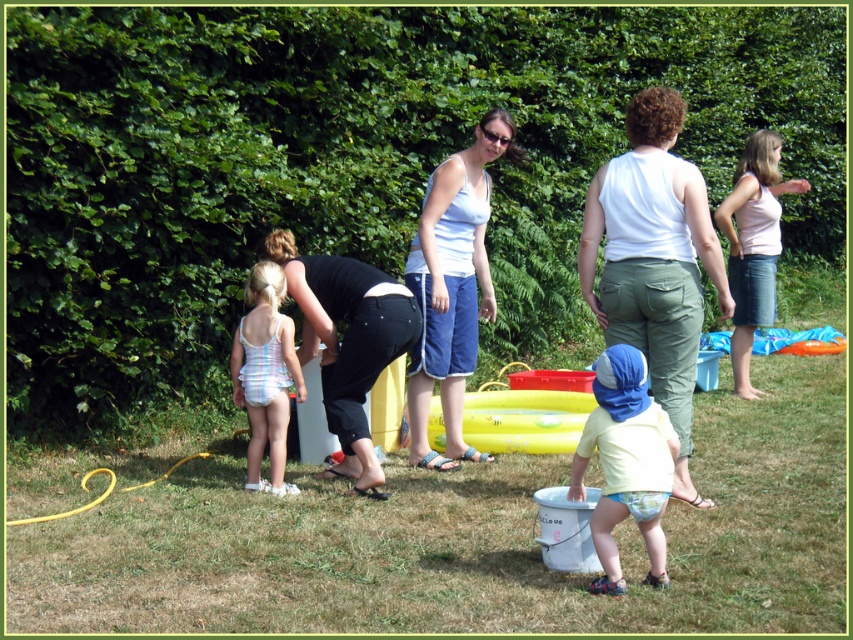
Question: Is pink cotton tank top at upper right wider than striped fabric swimsuit at center left?

Choices:
 (A) no
 (B) yes

Answer: (B)

Question: Estimate the real-world distances between objects in this image. Which object is farther from the pink cotton tank top at upper right?

Choices:
 (A) striped fabric swimsuit at center left
 (B) yellow cotton shirt at center

Answer: (B)

Question: Estimate the real-world distances between objects in this image. Which object is farther from the pink cotton tank top at upper right?

Choices:
 (A) striped fabric swimsuit at center left
 (B) yellow cotton shirt at center
 (C) white striped tank top at center

Answer: (B)

Question: Is the position of white cotton tank top at center more distant than that of yellow cotton shirt at center?

Choices:
 (A) no
 (B) yes

Answer: (B)

Question: Can you confirm if white cotton tank top at center is wider than striped fabric swimsuit at center left?

Choices:
 (A) no
 (B) yes

Answer: (B)

Question: Which object is the farthest from the striped fabric swimsuit at center left?

Choices:
 (A) pink cotton tank top at upper right
 (B) white striped tank top at center
 (C) white cotton tank top at center
 (D) yellow cotton shirt at center

Answer: (A)